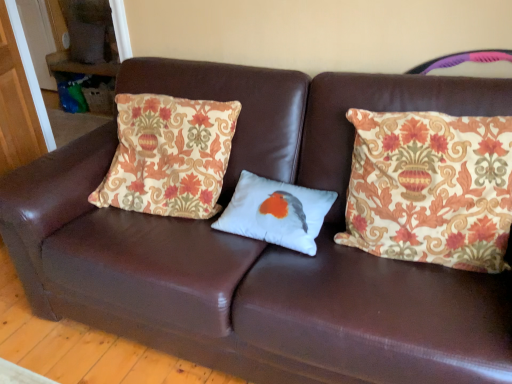
Question: In the image, is patterned fabric pillow at right, positioned as the third pillow in left-to-right order, positioned in front of or behind white matte pillow with bird design at center, marked as the second pillow in a right-to-left arrangement?

Choices:
 (A) behind
 (B) front

Answer: (B)

Question: Do you think patterned fabric pillow at right, positioned as the third pillow in left-to-right order, is within white matte pillow with bird design at center, positioned as the second pillow in left-to-right order, or outside of it?

Choices:
 (A) outside
 (B) inside

Answer: (A)

Question: Estimate the real-world distances between objects in this image. Which object is farther from the floral-patterned fabric pillow at left, the 1th pillow when ordered from left to right?

Choices:
 (A) patterned fabric pillow at right, acting as the 1th pillow starting from the right
 (B) white matte pillow with bird design at center, marked as the second pillow in a right-to-left arrangement

Answer: (A)

Question: Which object is the closest to the patterned fabric pillow at right, positioned as the third pillow in left-to-right order?

Choices:
 (A) white matte pillow with bird design at center, positioned as the second pillow in left-to-right order
 (B) floral-patterned fabric pillow at left, the 1th pillow when ordered from left to right

Answer: (A)